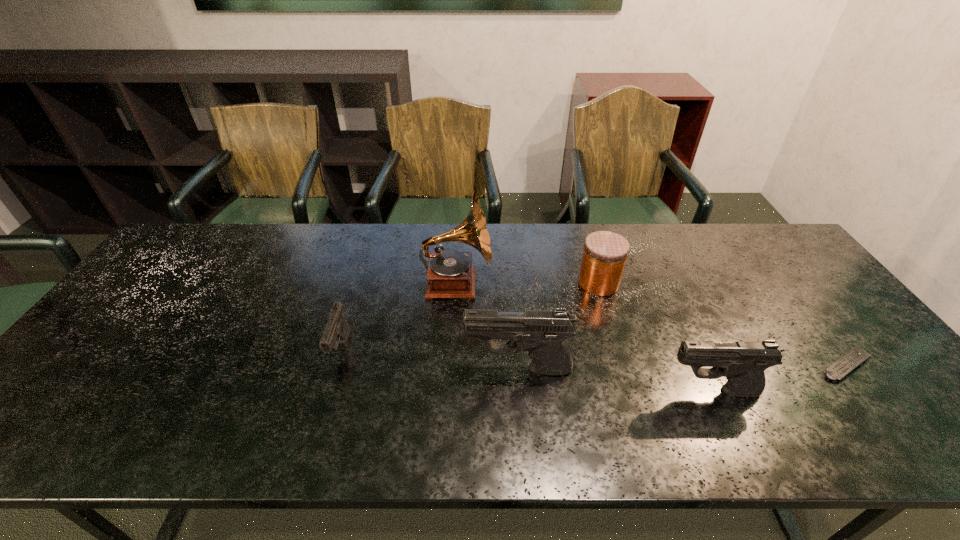
You are a GUI agent. You are given a task and a screenshot of the screen. Output one action in this format:
    pyautogui.click(x=<x>, y=<y>)
    Task: Click on the vacant region located at the barrel of the second pistol from left to right
    
    Given the screenshot: What is the action you would take?
    pyautogui.click(x=428, y=369)

Where is `free point located 0.230m at the barrel of the second pistol from left to right`? The height and width of the screenshot is (540, 960). free point located 0.230m at the barrel of the second pistol from left to right is located at coordinates (371, 369).

I want to click on vacant area situated at the barrel of the nearest object, so click(595, 392).

Identify the location of vacant area situated 0.050m at the barrel of the nearest object. The height and width of the screenshot is (540, 960). (643, 392).

Identify the location of vacant space situated 0.230m at the barrel of the nearest object. (565, 392).

In order to click on free space located 0.110m on the back of the jar in this screenshot , I will do `click(588, 248)`.

The width and height of the screenshot is (960, 540). What are the coordinates of `free space located 0.150m on the left of the remote control` in the screenshot? It's located at (756, 365).

Identify the location of free point located 0.330m on the horn of the tallest object. point(603,283).

Find the location of a particular element. object at the far edge is located at coordinates (451, 274).

I want to click on pistol that is at the near edge, so click(743, 364).